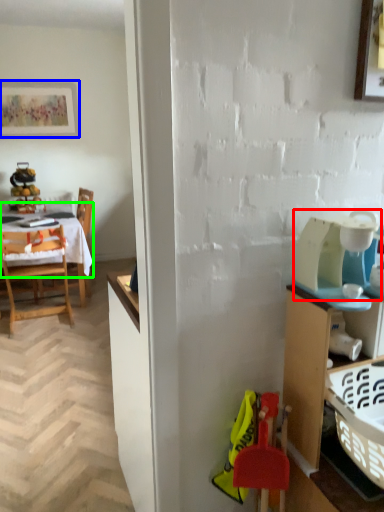
Question: Which is farther away from appliance (highlighted by a red box)? picture frame (highlighted by a blue box) or tablecloth (highlighted by a green box)?

Choices:
 (A) picture frame
 (B) tablecloth

Answer: (A)